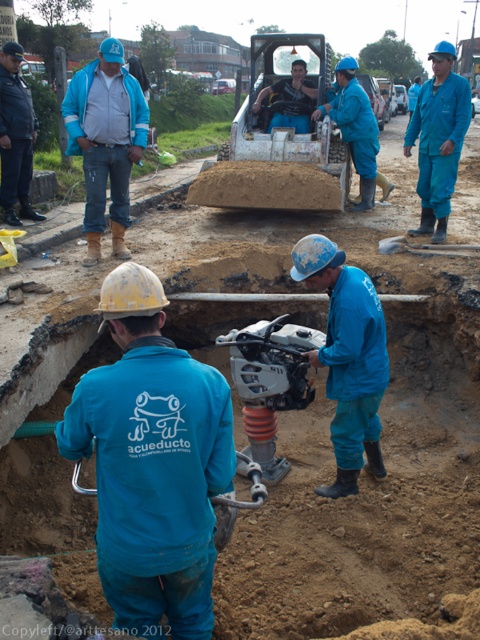
Question: Can you confirm if blue matte uniform at center is wider than matte blue helmet at center?

Choices:
 (A) no
 (B) yes

Answer: (A)

Question: Can you confirm if blue matte jumpsuit at center is wider than matte blue helmet at center?

Choices:
 (A) no
 (B) yes

Answer: (A)

Question: Which object is closer to the camera taking this photo?

Choices:
 (A) blue matte jumpsuit at center
 (B) blue matte uniform at center
 (C) matte blue jacket at upper left
 (D) matte blue helmet at center

Answer: (B)

Question: From the image, what is the correct spatial relationship of matte blue jacket at upper left in relation to blue matte jumpsuit at center?

Choices:
 (A) left
 (B) right

Answer: (A)

Question: Among these points, which one is farthest from the camera?

Choices:
 (A) (428, 92)
 (B) (373, 376)
 (C) (20, 106)
 (D) (71, 138)

Answer: (C)

Question: Which point is closer to the camera taking this photo?

Choices:
 (A) (448, 90)
 (B) (0, 67)

Answer: (A)